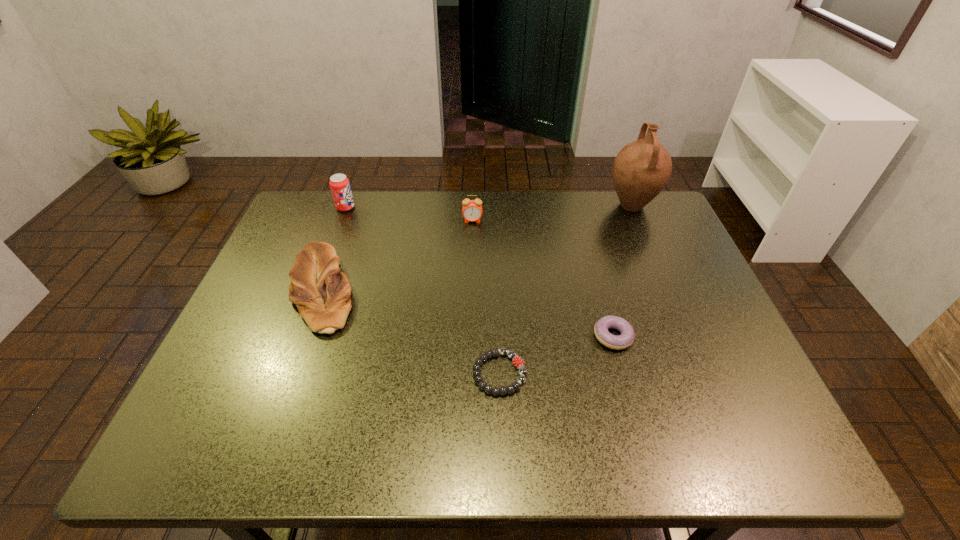
Locate an element on the screen. The width and height of the screenshot is (960, 540). object positioned at the far left corner is located at coordinates (340, 187).

Locate an element on the screen. object positioned at the far right corner is located at coordinates (642, 168).

Identify the location of free space at the far edge of the desktop. (435, 193).

Locate an element on the screen. The image size is (960, 540). vacant space at the near edge of the desktop is located at coordinates (516, 428).

In the image, there is a desktop. Identify the location of vacant space at the left edge. The image size is (960, 540). (299, 337).

Image resolution: width=960 pixels, height=540 pixels. Find the location of `free spot at the right edge of the desktop`. free spot at the right edge of the desktop is located at coordinates click(x=745, y=365).

Image resolution: width=960 pixels, height=540 pixels. Identify the location of free spot at the far left corner of the desktop. (314, 208).

Identify the location of free space at the near right corner of the desktop. (757, 451).

You are a GUI agent. You are given a task and a screenshot of the screen. Output one action in this format:
    pyautogui.click(x=<x>, y=<y>)
    Task: Click on the free space between the third tallest object and the soda can
    The height and width of the screenshot is (540, 960).
    Given the screenshot: What is the action you would take?
    (x=409, y=214)

Where is `vacant region between the tallest object and the third tallest object`? The width and height of the screenshot is (960, 540). vacant region between the tallest object and the third tallest object is located at coordinates (552, 213).